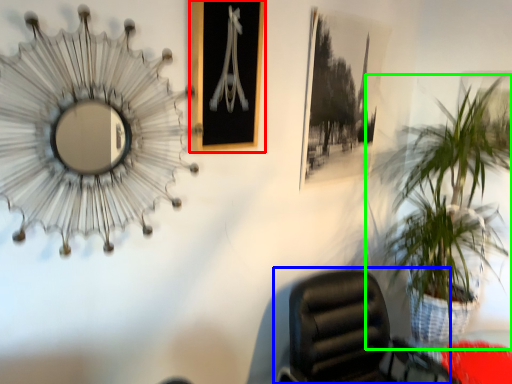
Question: Considering the real-world distances, which object is farthest from picture frame (highlighted by a red box)? chair (highlighted by a blue box) or houseplant (highlighted by a green box)?

Choices:
 (A) chair
 (B) houseplant

Answer: (B)